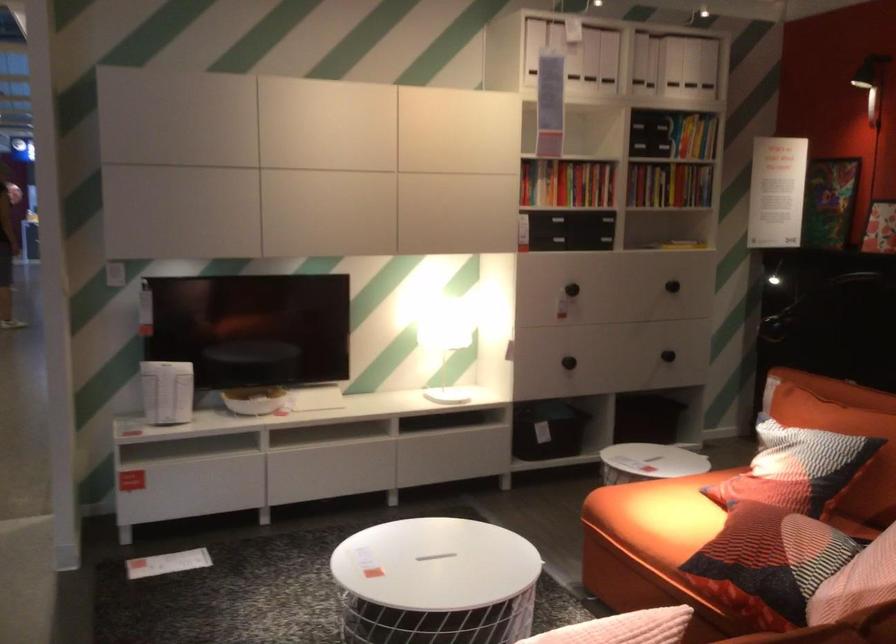
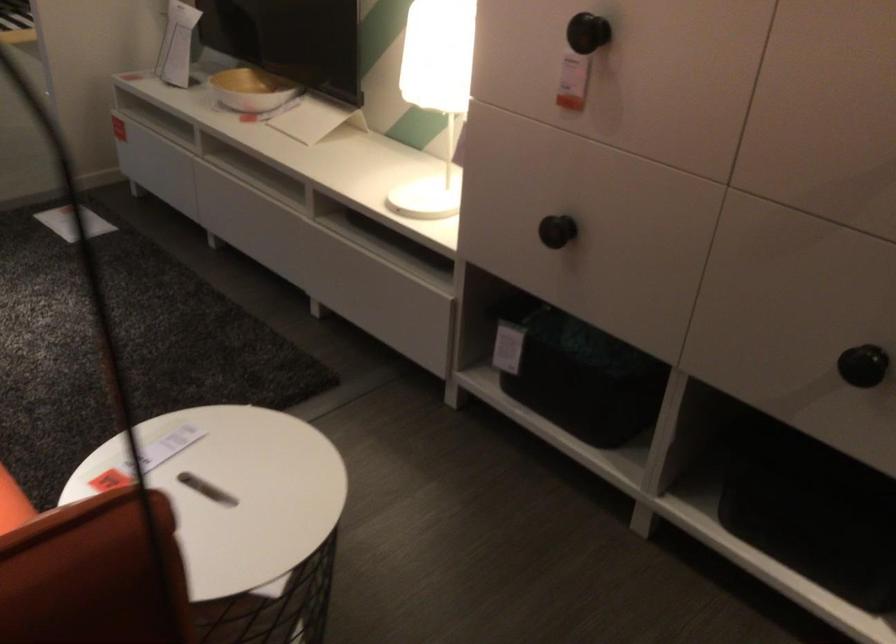
The point at (x=266, y=406) is marked in the first image. Where is the corresponding point in the second image?

(251, 90)